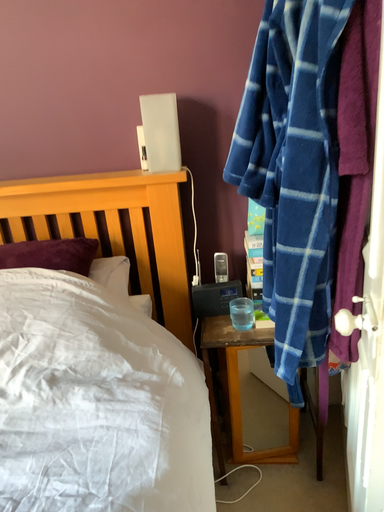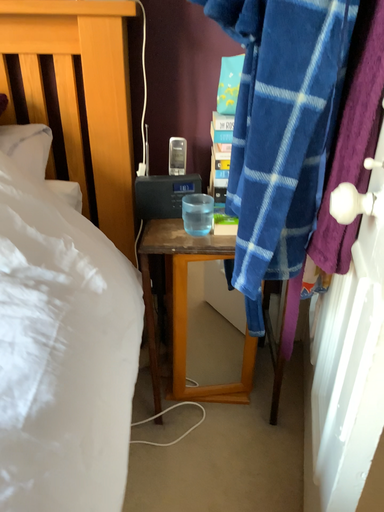
Question: Which way did the camera rotate in the video?

Choices:
 (A) rotated downward
 (B) rotated upward

Answer: (A)